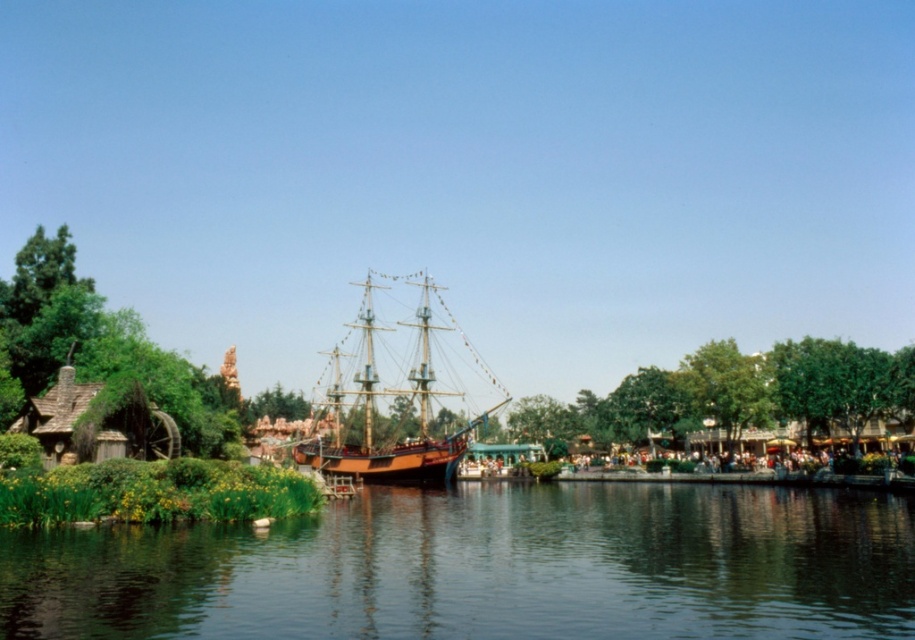
Question: Does smooth dark water at center have a larger size compared to wooden ship at center?

Choices:
 (A) no
 (B) yes

Answer: (A)

Question: Can you confirm if smooth dark water at center is positioned to the right of wooden ship at center?

Choices:
 (A) no
 (B) yes

Answer: (B)

Question: Which point is farther from the camera taking this photo?

Choices:
 (A) (385, 449)
 (B) (497, 492)

Answer: (A)

Question: Among these points, which one is nearest to the camera?

Choices:
 (A) (371, 426)
 (B) (822, 520)

Answer: (B)

Question: Is smooth dark water at center to the right of wooden ship at center from the viewer's perspective?

Choices:
 (A) yes
 (B) no

Answer: (A)